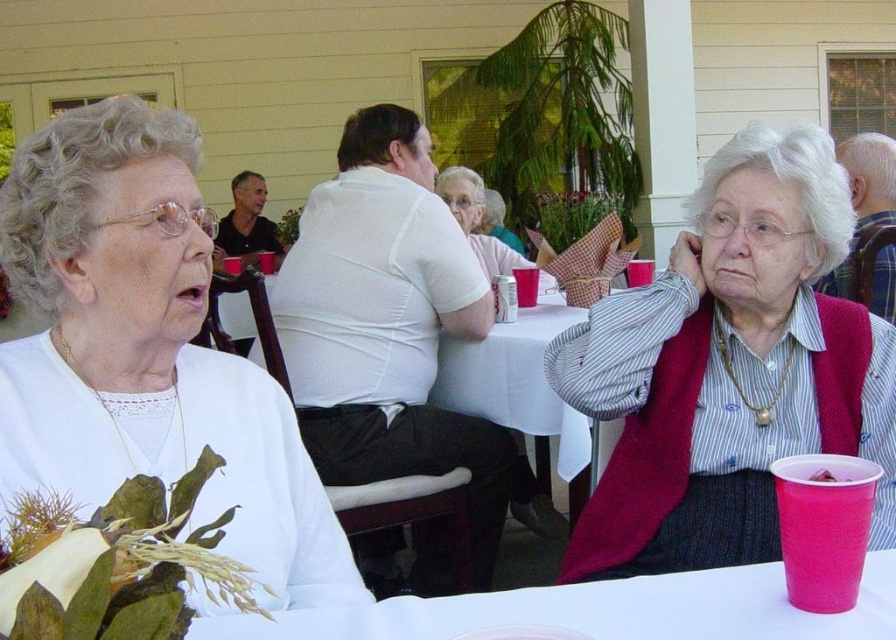
Based on the photo, measure the distance from striped fabric shirt at center to pink plastic cup at lower right.

striped fabric shirt at center is 26.54 inches from pink plastic cup at lower right.

Is point (739, 163) closer to viewer compared to point (821, 481)?

No, it is not.

Is point (747, 260) more distant than point (826, 472)?

Yes, point (747, 260) is behind point (826, 472).

Where is `striped fabric shirt at center`? striped fabric shirt at center is located at coordinates (729, 369).

Can you confirm if white matte shirt at upper left is positioned to the left of white plastic table at lower center?

Correct, you'll find white matte shirt at upper left to the left of white plastic table at lower center.

Can you confirm if white matte shirt at upper left is taller than white plastic table at lower center?

Yes.

The image size is (896, 640). I want to click on white matte shirt at upper left, so click(x=145, y=349).

Is point (132, 189) positioned in front of point (791, 298)?

That is True.

Who is more forward, (192,464) or (659,545)?

Point (192,464)

Measure the distance between white matte shirt at upper left and camera.

white matte shirt at upper left and camera are 27.20 inches apart.

This screenshot has width=896, height=640. In order to click on white matte shirt at upper left in this screenshot , I will do `click(145, 349)`.